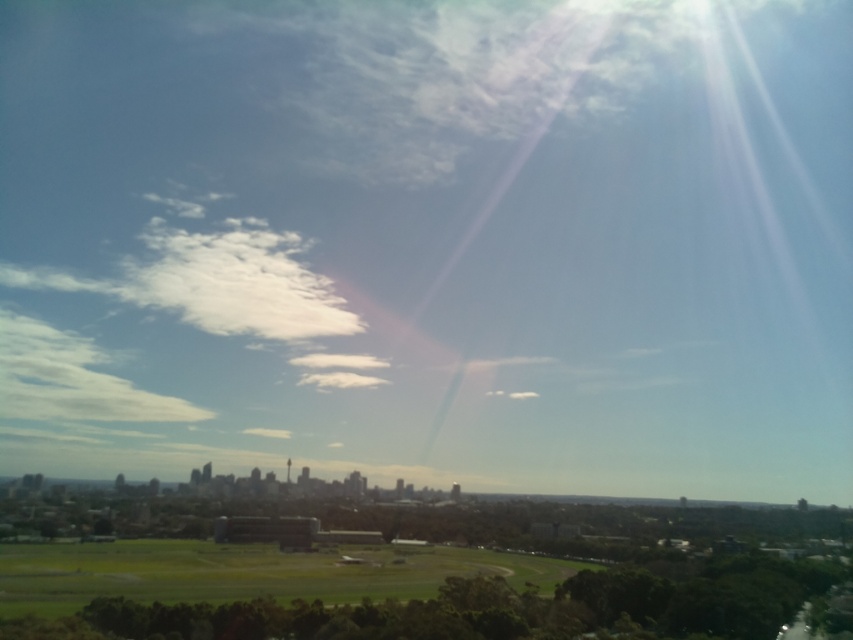
Question: Where is green grassy field at lower left located in relation to white fluffy cloud at upper left in the image?

Choices:
 (A) above
 (B) below

Answer: (B)

Question: Which point is farther from the camera taking this photo?

Choices:
 (A) (142, 593)
 (B) (149, 401)

Answer: (B)

Question: Which object appears farthest from the camera in this image?

Choices:
 (A) green grassy field at lower left
 (B) white fluffy cloud at upper left

Answer: (B)

Question: Is green grassy field at lower left positioned in front of white fluffy cloud at upper left?

Choices:
 (A) no
 (B) yes

Answer: (B)

Question: From the image, what is the correct spatial relationship of green grassy field at lower left in relation to white fluffy cloud at upper left?

Choices:
 (A) below
 (B) above

Answer: (A)